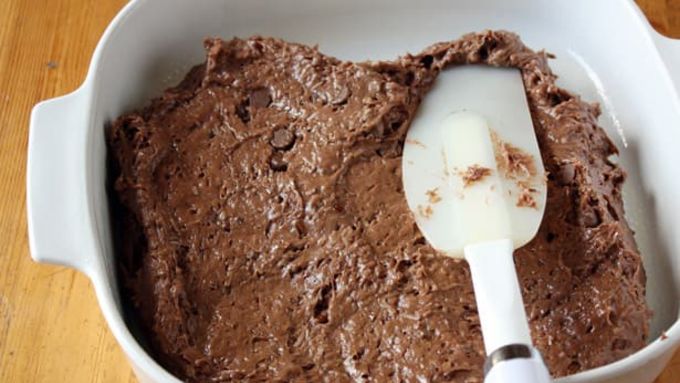
Image resolution: width=680 pixels, height=383 pixels. I want to click on wood grain, so click(x=58, y=37).